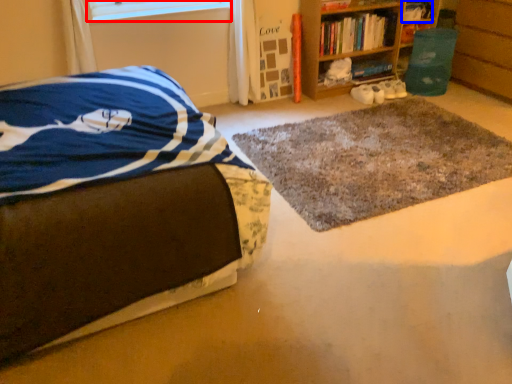
Question: Which object appears closest to the camera in this image, window screen (highlighted by a red box) or book (highlighted by a blue box)?

Choices:
 (A) window screen
 (B) book

Answer: (A)